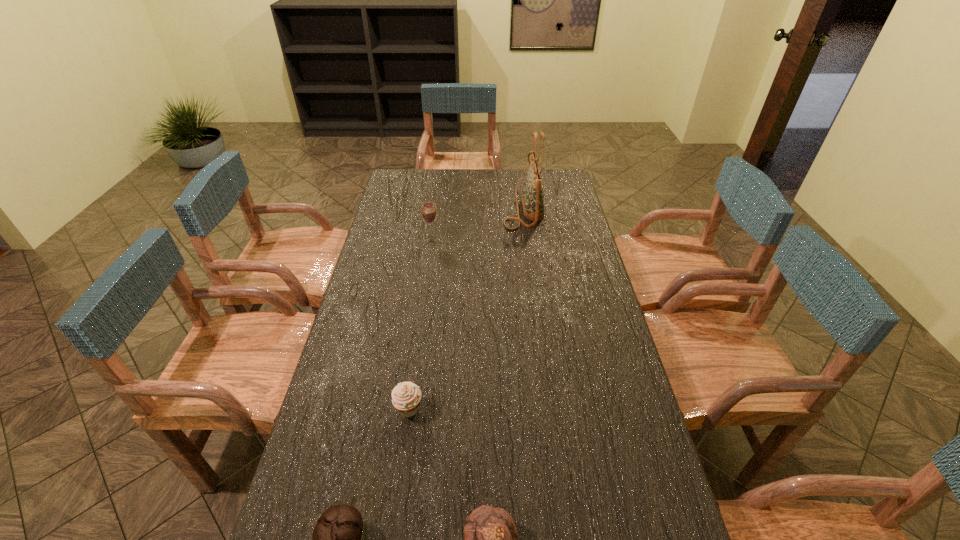
You are a GUI agent. You are given a task and a screenshot of the screen. Output one action in this format:
    pyautogui.click(x=<x>, y=<y>)
    Task: Click on the blank region between the second farthest object and the rightmost object
    This screenshot has height=540, width=960.
    Given the screenshot: What is the action you would take?
    477,224

What are the coordinates of `empty space between the second farthest object and the second muffin from left to right` in the screenshot? It's located at (420, 325).

Locate an element on the screen. The height and width of the screenshot is (540, 960). free point between the farthest muffin and the second farthest object is located at coordinates (420, 325).

In order to click on object that is the fourth closest one to the rightmost muffin in this screenshot , I will do `click(533, 197)`.

I want to click on object that is the third closest to the second muffin from right to left, so click(x=429, y=214).

Where is `the second closest muffin to the farthest muffin`? the second closest muffin to the farthest muffin is located at coordinates (490, 535).

Locate an element on the screen. The image size is (960, 540). muffin that stands as the third closest to the fourth nearest object is located at coordinates (490, 535).

The width and height of the screenshot is (960, 540). I want to click on vacant point that satisfies the following two spatial constraints: 1. on the front-facing side of the farthest object; 2. on the front side of the second tallest object, so click(x=527, y=240).